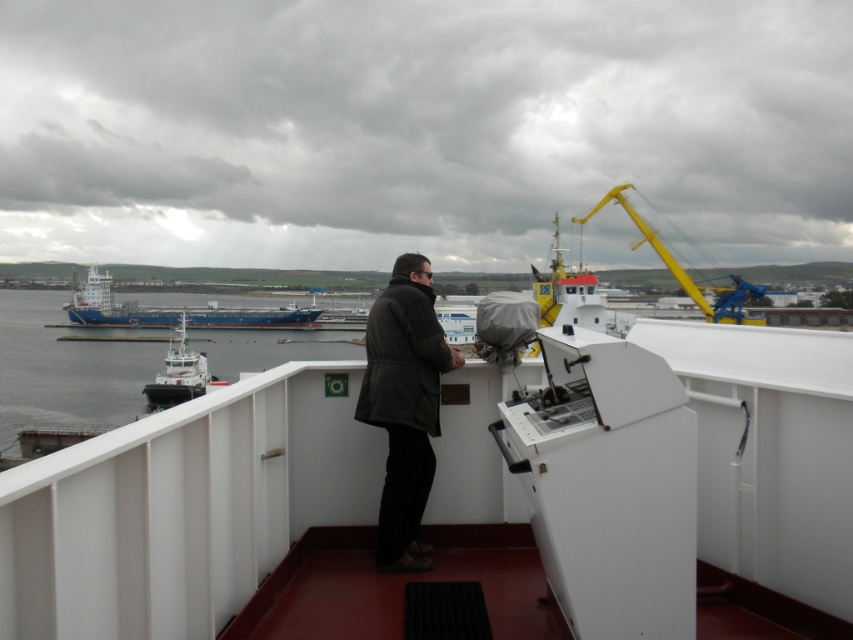
Can you confirm if dark gray jacket at center is positioned above blue matte cargo ship at left?

No, dark gray jacket at center is not above blue matte cargo ship at left.

Who is more distant from viewer, (399, 259) or (138, 307)?

Positioned behind is point (138, 307).

Describe the element at coordinates (404, 404) in the screenshot. Image resolution: width=853 pixels, height=640 pixels. I see `dark gray jacket at center` at that location.

The width and height of the screenshot is (853, 640). What are the coordinates of `dark gray jacket at center` in the screenshot? It's located at pos(404,404).

Based on the photo, is yellow metallic crane at upper center wider than white glossy tugboat at left?

Yes, yellow metallic crane at upper center is wider than white glossy tugboat at left.

The height and width of the screenshot is (640, 853). I want to click on yellow metallic crane at upper center, so 685,269.

Locate an element on the screen. yellow metallic crane at upper center is located at coordinates (685, 269).

How far apart are dark gray jacket at center and white glossy boat at center?

They are 7.70 meters apart.

Is dark gray jacket at center to the right of white glossy boat at center from the viewer's perspective?

No, dark gray jacket at center is not to the right of white glossy boat at center.

I want to click on dark gray jacket at center, so click(x=404, y=404).